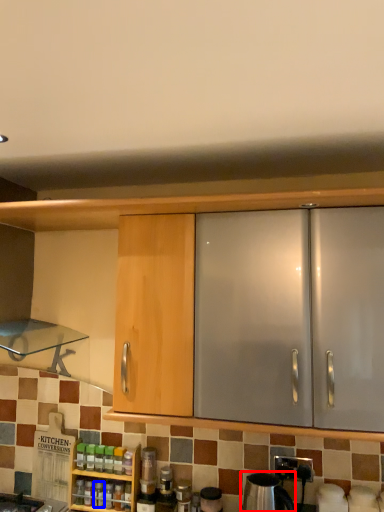
Question: Which object appears farthest to the camera in this image, appliance (highlighted by a red box) or bottle (highlighted by a blue box)?

Choices:
 (A) appliance
 (B) bottle

Answer: (B)